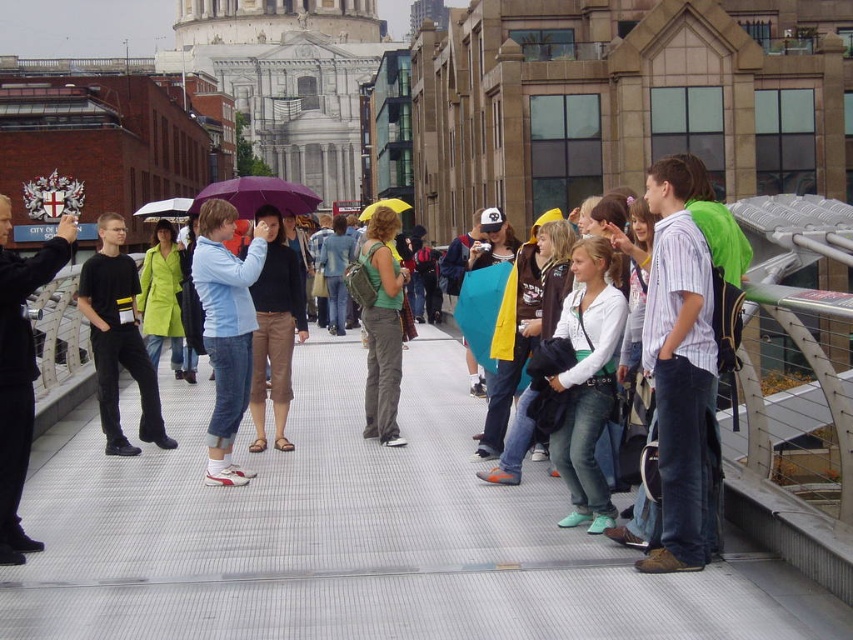
Does black cotton shirt at left appear on the left side of green fabric backpack at center?

Yes, black cotton shirt at left is to the left of green fabric backpack at center.

Is black cotton shirt at left above green fabric backpack at center?

Yes.

Is point (109, 300) more distant than point (392, 410)?

That is False.

This screenshot has width=853, height=640. In order to click on black cotton shirt at left in this screenshot , I will do `click(119, 339)`.

Which is more to the left, black matte shirt at left or light blue cotton shirt at center?

black matte shirt at left

Does black matte shirt at left come behind light blue cotton shirt at center?

No, it is in front of light blue cotton shirt at center.

Between point (9, 314) and point (264, 330), which one is positioned behind?

The point (264, 330) is more distant.

Find the location of a particular element. This screenshot has height=640, width=853. black matte shirt at left is located at coordinates (20, 371).

Is light blue cotton shirt at center above transparent plastic umbrella at center?

No.

Is light blue cotton shirt at center taller than transparent plastic umbrella at center?

Yes, light blue cotton shirt at center is taller than transparent plastic umbrella at center.

The image size is (853, 640). I want to click on light blue cotton shirt at center, so click(x=276, y=330).